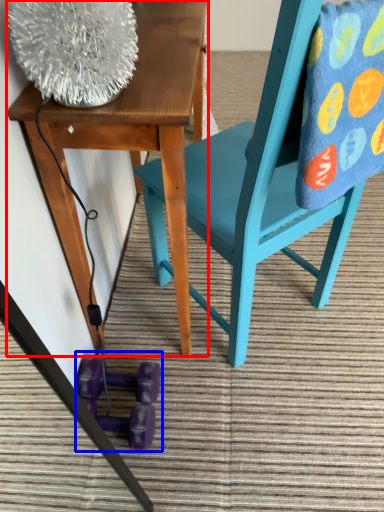
Question: Which of the following is the farthest to the observer, table (highlighted by a red box) or toy (highlighted by a blue box)?

Choices:
 (A) table
 (B) toy

Answer: (B)